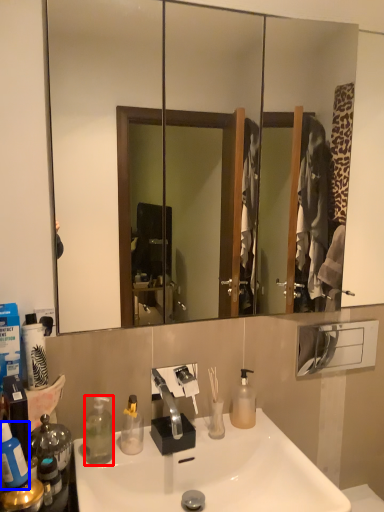
Question: Which point is further to the camera, bottle (highlighted by a red box) or bottle (highlighted by a blue box)?

Choices:
 (A) bottle
 (B) bottle

Answer: (A)